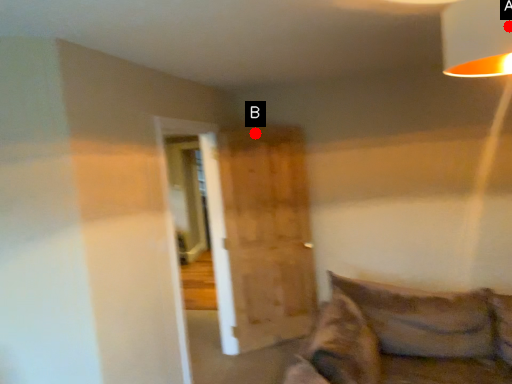
Question: Two points are circled on the image, labeled by A and B beside each circle. Which point is further to the camera?

Choices:
 (A) A is further
 (B) B is further

Answer: (B)